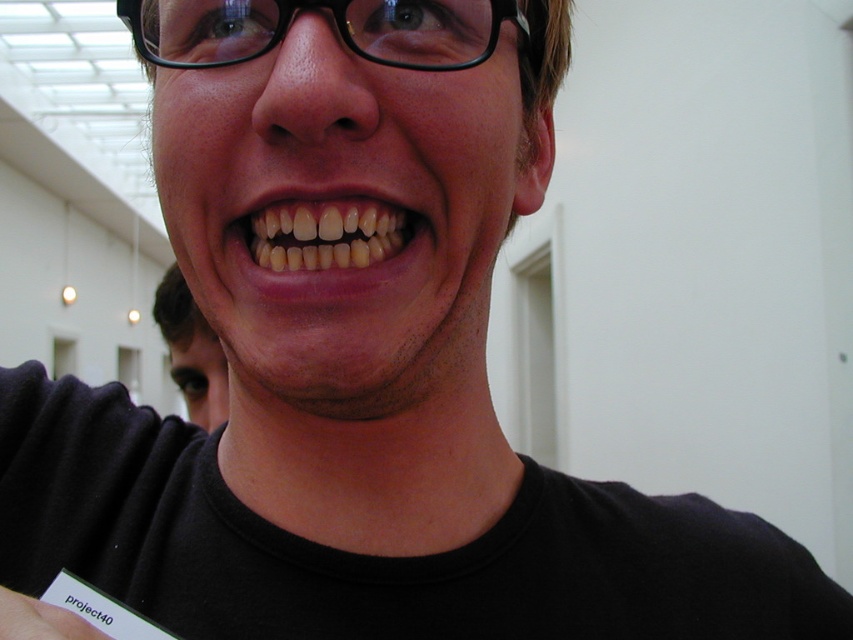
You are a photographer trying to capture a clear image of the name tag on the person wearing a black T shirt. The name tag is at point (302,244). You need to adjust your camera focus to ensure the name tag is sharp. What is the minimum distance you should set your camera focus to capture the name tag clearly?

The minimum distance you should set your camera focus to capture the name tag clearly is 14.43 inches, as the point (302,244) is 14.43 inches away from the camera.

You are a photographer adjusting the focus of your camera. You notice the natural yellow teeth at center and the white paper at lower left in your viewfinder. Which object should you focus on to ensure it appears clearer in the final photo if you want the wider object to be in focus?

The natural yellow teeth at center should be focused on because its width is larger than the white paper at lower left, making it the wider object.